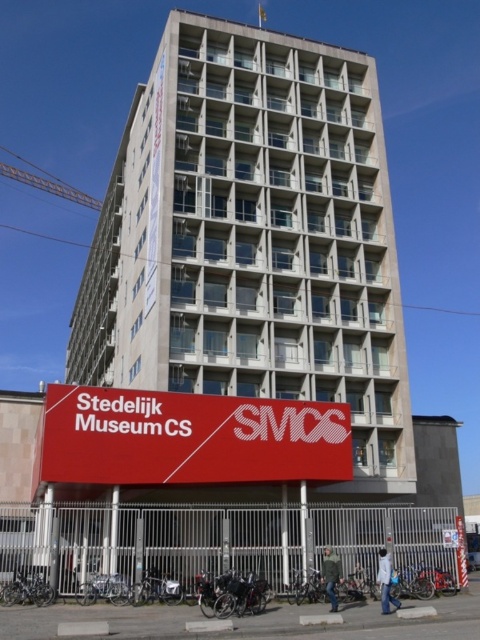
Is concrete building at center to the right of red matte sign at lower center from the viewer's perspective?

No, concrete building at center is not to the right of red matte sign at lower center.

From the picture: Who is more forward, [317,305] or [92,451]?

Point [92,451] is more forward.

Is point (220, 368) closer to viewer compared to point (126, 412)?

No, it is behind (126, 412).

Image resolution: width=480 pixels, height=640 pixels. I want to click on concrete building at center, so click(x=254, y=243).